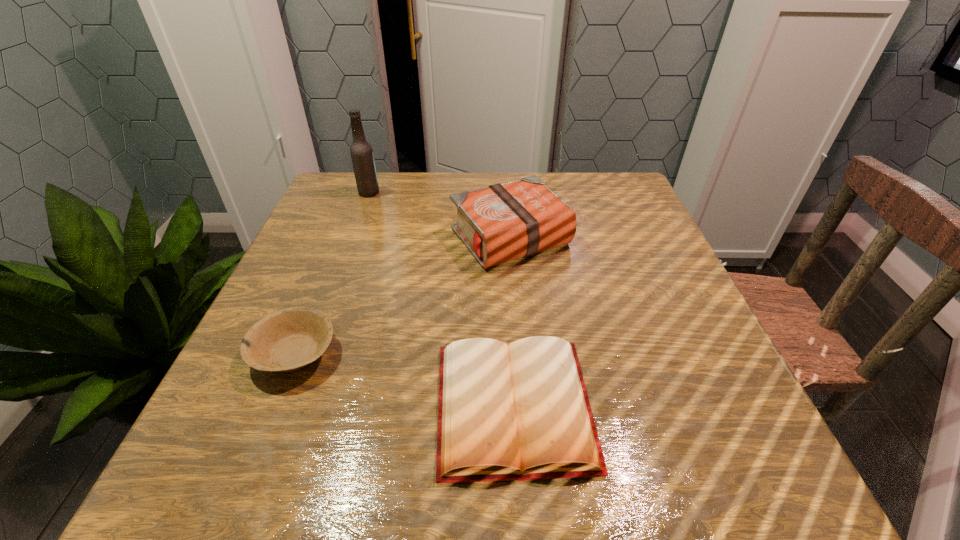
Locate an element on the screen. The width and height of the screenshot is (960, 540). beer bottle is located at coordinates (361, 151).

Find the location of a particular element. This screenshot has height=540, width=960. the farthest object is located at coordinates (361, 151).

You are a GUI agent. You are given a task and a screenshot of the screen. Output one action in this format:
    pyautogui.click(x=<x>, y=<y>)
    Task: Click on the taller Bible
    This screenshot has height=540, width=960.
    Given the screenshot: What is the action you would take?
    pyautogui.click(x=503, y=222)

At what (x,y) coordinates should I click in order to perform the action: click on the second tallest object. Please return your answer as a coordinate pair (x, y). Looking at the image, I should click on (503, 222).

The image size is (960, 540). Identify the location of the second shortest object. [x=287, y=340].

Find the location of a particular element. This screenshot has width=960, height=540. the shortest object is located at coordinates point(521,412).

At what (x,y) coordinates should I click in order to perform the action: click on the nearer Bible. Please return your answer as a coordinate pair (x, y). This screenshot has width=960, height=540. Looking at the image, I should click on (521, 412).

The height and width of the screenshot is (540, 960). Identify the location of vacant space located on the side of the farthest object with the label. [447, 192].

I want to click on vacant space located on the front of the taller Bible, so (x=520, y=349).

Identify the location of vacant space located 0.240m on the right of the bowl. (476, 353).